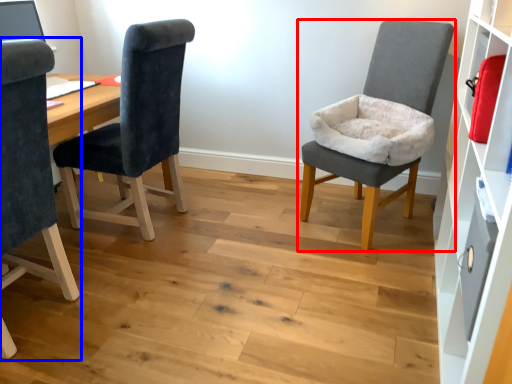
Question: Which of the following is the closest to the observer, chair (highlighted by a red box) or chair (highlighted by a blue box)?

Choices:
 (A) chair
 (B) chair

Answer: (B)